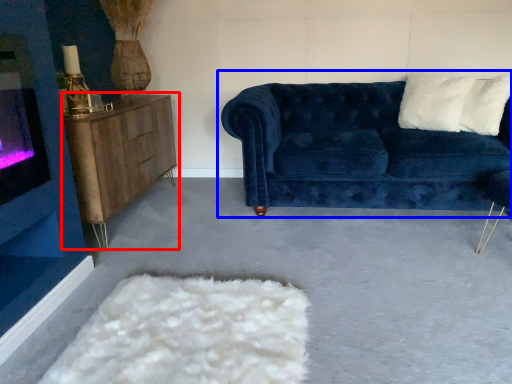
Question: Which point is further to the camera, table (highlighted by a red box) or studio couch (highlighted by a blue box)?

Choices:
 (A) table
 (B) studio couch

Answer: (B)